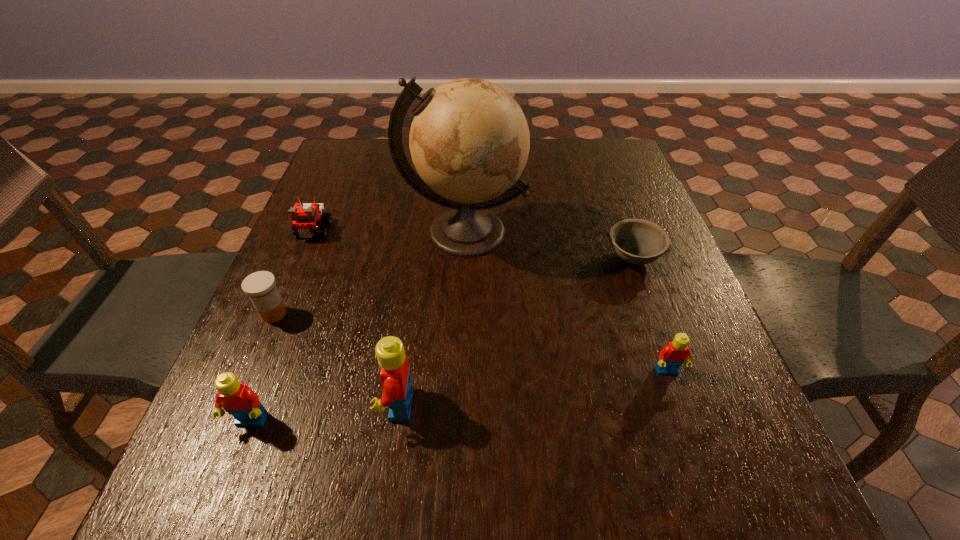
To achieve even spacing by inserting another Lego among them, please point to a vacant spot for this new Lego. Please provide its 2D coordinates. Your answer should be formatted as a tuple, i.e. [(x, y)], where the tuple contains the x and y coordinates of a point satisfying the conditions above.

[(537, 388)]